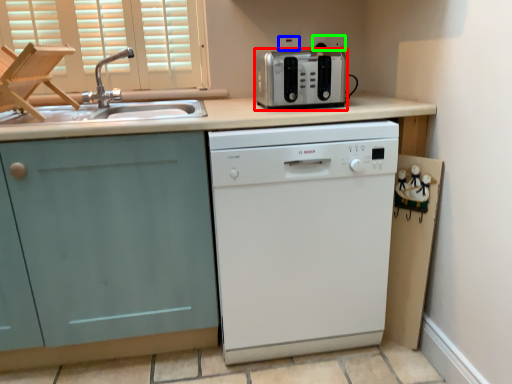
Question: Which is farther away from kitchen appliance (highlighted by a red box)? electric outlet (highlighted by a blue box) or electric outlet (highlighted by a green box)?

Choices:
 (A) electric outlet
 (B) electric outlet

Answer: (A)